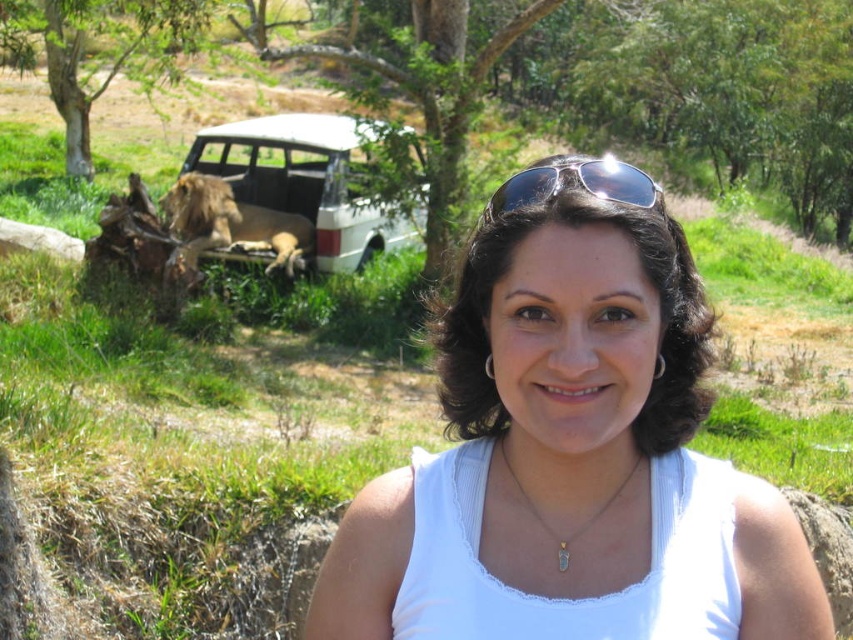
Question: Does white matte car at center have a smaller size compared to sunglasses at center?

Choices:
 (A) yes
 (B) no

Answer: (A)

Question: Can you confirm if white fabric at center is positioned to the right of sunglasses at center?

Choices:
 (A) no
 (B) yes

Answer: (A)

Question: Estimate the real-world distances between objects in this image. Which object is closer to the sunglasses at center?

Choices:
 (A) gold chain at center
 (B) golden fur lion at left
 (C) white fabric at center
 (D) white matte car at center

Answer: (C)

Question: Which point is closer to the camera?

Choices:
 (A) 9,17
 (B) 505,467
 (C) 163,208

Answer: (B)

Question: Does white fabric at center appear on the right side of green leafy tree at upper left?

Choices:
 (A) no
 (B) yes

Answer: (B)

Question: Which of the following is the closest to the observer?

Choices:
 (A) (204, 209)
 (B) (404, 573)

Answer: (B)